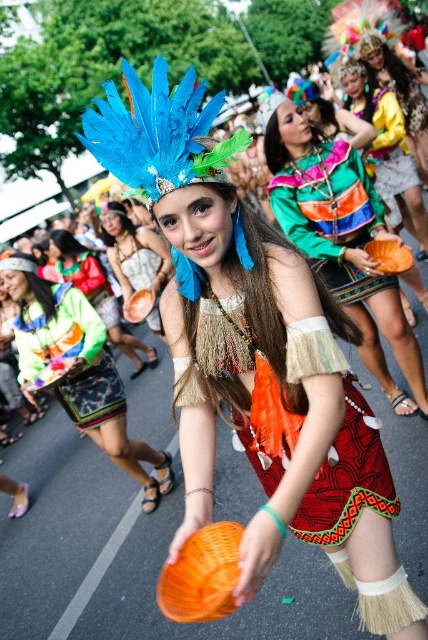
From the picture: You are standing in the middle of the street festival and see two points marked in the scene. Which point, point (416, 410) or point (403, 131), is closer to you?

Point (416, 410) is closer to the viewer than point (403, 131).

Looking at this image, you are a photographer standing at the festival. You want to take a photo of the shiny orange pumpkin at center so that it fills the frame without any distortion. The camera you have can focus clearly up to 2 meters. Will the pumpkin be in focus?

The shiny orange pumpkin at center is 1.91 meters away from camera, which is within the camera focus range of up to 2 meters. Therefore, the pumpkin will be in focus.

You are a participant in the carnival parade holding a matte blue feather headdress at upper center. You need to hand over an object to another performer who is 2 meters away from you. Can you reach the matte orange bowl at center to pass it to them?

The matte orange bowl at center is 2.53 meters away from the matte blue feather headdress at upper center. Since the performer is only 2 meters away, you cannot reach the matte orange bowl at center in time to pass it to them.